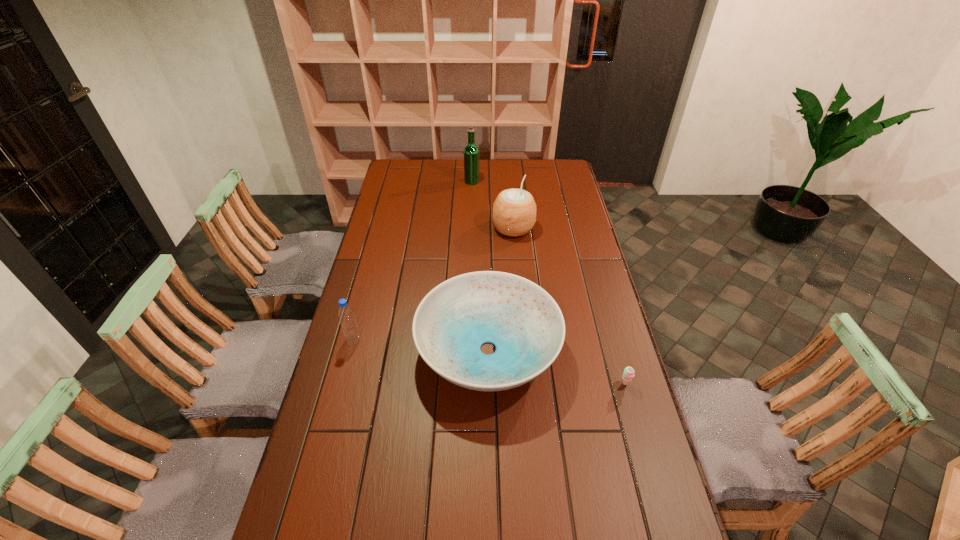
Locate an element on the screen. beer bottle is located at coordinates (471, 152).

The image size is (960, 540). I want to click on the tallest object, so click(471, 152).

The height and width of the screenshot is (540, 960). I want to click on the second farthest object, so click(514, 211).

This screenshot has width=960, height=540. In order to click on coconut in this screenshot , I will do `click(514, 211)`.

Locate an element on the screen. the leftmost object is located at coordinates (346, 315).

Where is `water bottle`? water bottle is located at coordinates (346, 315).

Image resolution: width=960 pixels, height=540 pixels. What are the coordinates of `dish` in the screenshot? It's located at (522, 320).

Locate an element on the screen. The width and height of the screenshot is (960, 540). the rightmost object is located at coordinates (628, 374).

Locate an element on the screen. Image resolution: width=960 pixels, height=540 pixels. sherbert is located at coordinates (628, 374).

This screenshot has height=540, width=960. Identify the location of vacant space located 0.100m on the front of the tallest object. (471, 197).